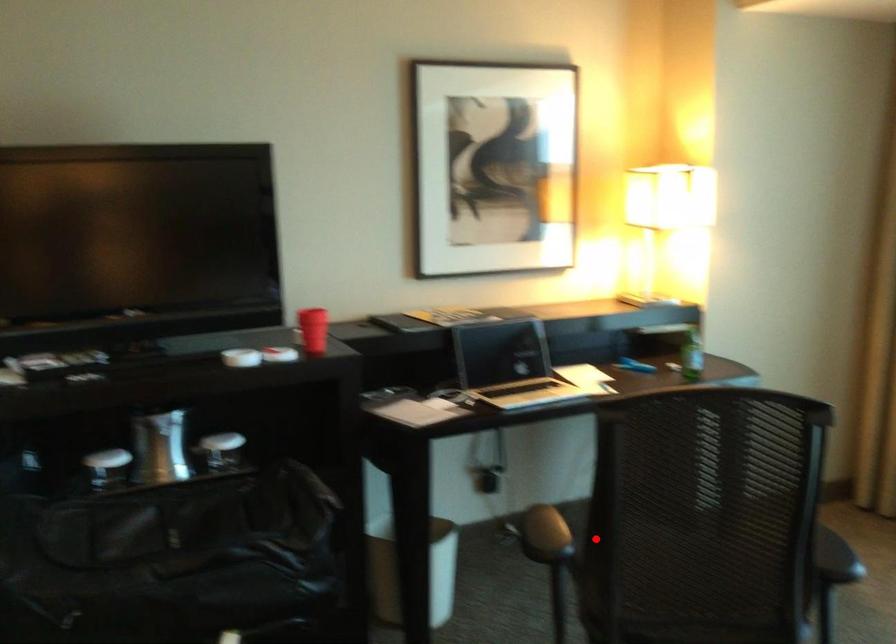
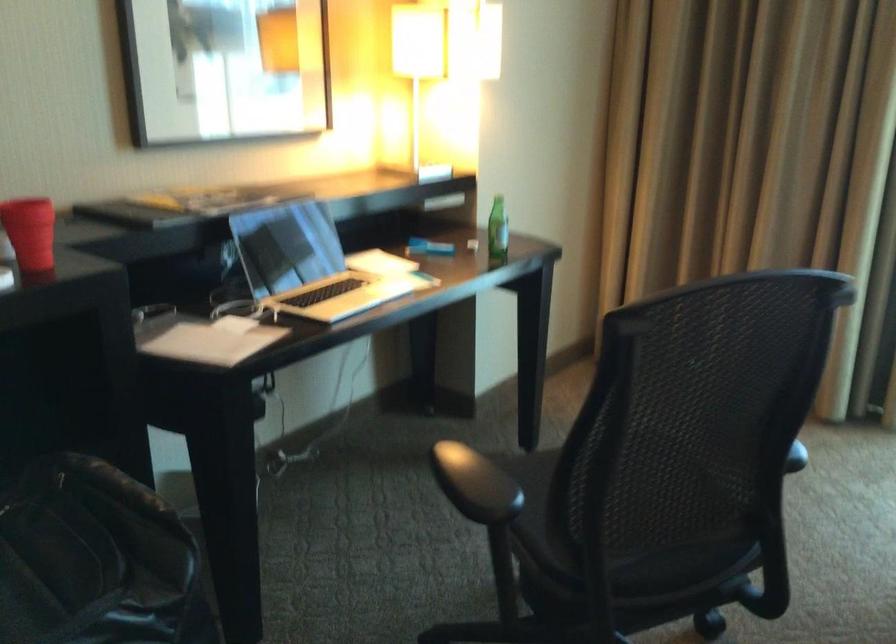
Question: I am providing you with two images of the same scene from different viewpoints. Image1 has a red point marked. In image2, the corresponding 3D location appears at what relative position? Reply with the corresponding letter.

Choices:
 (A) Closer
 (B) Farther

Answer: (A)